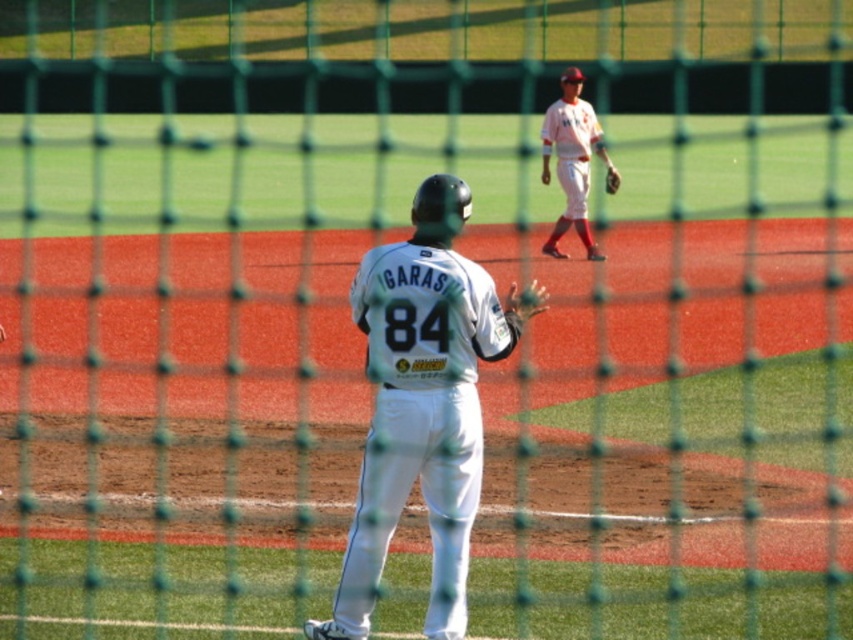
You are a spectator sitting behind the green netting at the baseball game. You want to throw a small ball to the player wearing the white matte uniform at center. Considering the netting is 10 feet away from you, can you reach the player with your throw?

The white matte uniform at center is 24.53 feet away from the camera. Since the netting is 10 feet away from you, the remaining distance to the player is 14.53 feet. You can likely reach the player with your throw.

You are a spectator at the baseball game, and you want to know if the white uniform at upper center is positioned higher than the brown leather glove at center. Can you determine this based on the scene?

The white uniform at upper center is above the brown leather glove at center, so yes, the white uniform at upper center is positioned higher than the brown leather glove at center.